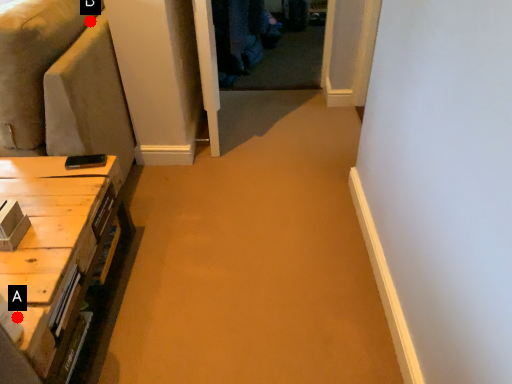
Question: Two points are circled on the image, labeled by A and B beside each circle. Which point is further to the camera?

Choices:
 (A) A is further
 (B) B is further

Answer: (B)